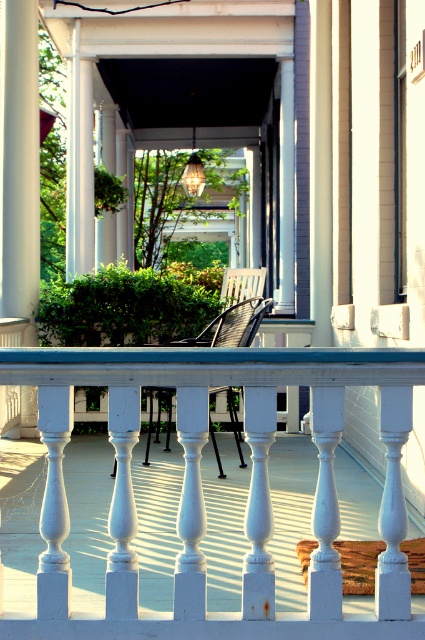
Who is more distant from viewer, (198, 365) or (248, 304)?

Positioned behind is point (248, 304).

Can you confirm if white painted wood balustrade at center is shorter than black woven chair at center?

No, white painted wood balustrade at center is not shorter than black woven chair at center.

Is point (218, 380) positioned in front of point (176, 340)?

Yes.

Where is `white painted wood balustrade at center`? The width and height of the screenshot is (425, 640). white painted wood balustrade at center is located at coordinates (201, 486).